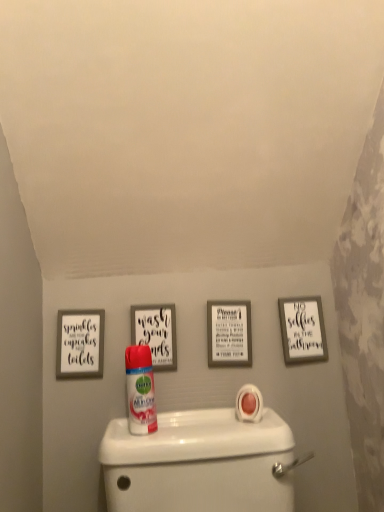
How much space does white matte picture frame at center, which is the third picture frame in left-to-right order, occupy vertically?

The height of white matte picture frame at center, which is the third picture frame in left-to-right order, is 7.19 inches.

What do you see at coordinates (140, 390) in the screenshot?
I see `white plastic can at center` at bounding box center [140, 390].

Locate an element on the screen. The width and height of the screenshot is (384, 512). white plastic can at center is located at coordinates (140, 390).

This screenshot has height=512, width=384. What do you see at coordinates (302, 330) in the screenshot?
I see `white matte picture frame at upper right, acting as the fourth picture frame starting from the left` at bounding box center [302, 330].

Identify the location of white glossy toilet at lower center. This screenshot has height=512, width=384. (200, 463).

Is white glossy toilet at lower center at the left side of white plastic can at center?

Incorrect, white glossy toilet at lower center is not on the left side of white plastic can at center.

Is white glossy toilet at lower center positioned in front of white plastic can at center?

Yes, white glossy toilet at lower center is in front of white plastic can at center.

From a real-world perspective, is white glossy toilet at lower center on top of white plastic can at center?

Actually, white glossy toilet at lower center is physically below white plastic can at center in the real world.

Where is `cleaning product that appears on the left of white glossy toilet at lower center`? cleaning product that appears on the left of white glossy toilet at lower center is located at coordinates (140, 390).

Which is correct: white glossy toilet at lower center is inside white matte picture frame at center, which is the second picture frame from right to left, or outside of it?

white glossy toilet at lower center exists outside the volume of white matte picture frame at center, which is the second picture frame from right to left.

Considering their positions, is white glossy toilet at lower center located in front of or behind white matte picture frame at center, which is the third picture frame in left-to-right order?

white glossy toilet at lower center is positioned closer to the viewer than white matte picture frame at center, which is the third picture frame in left-to-right order.

Does white glossy toilet at lower center have a larger size compared to white matte picture frame at center, which is the third picture frame in left-to-right order?

Correct, white glossy toilet at lower center is larger in size than white matte picture frame at center, which is the third picture frame in left-to-right order.

How distant is white glossy toilet at lower center from white matte picture frame at center, which is the second picture frame from right to left?

white glossy toilet at lower center and white matte picture frame at center, which is the second picture frame from right to left, are 10.29 inches apart from each other.

Is white matte picture frame at center, which is the third picture frame in left-to-right order, not within matte black picture frame at center, arranged as the 3th picture frame when viewed from the right?

Yes, white matte picture frame at center, which is the third picture frame in left-to-right order, is located beyond the bounds of matte black picture frame at center, arranged as the 3th picture frame when viewed from the right.

From a real-world perspective, is white matte picture frame at center, which is the third picture frame in left-to-right order, on matte black picture frame at center, arranged as the 3th picture frame when viewed from the right?

Actually, white matte picture frame at center, which is the third picture frame in left-to-right order, is physically below matte black picture frame at center, arranged as the 3th picture frame when viewed from the right, in the real world.

Considering the relative positions of white matte picture frame at center, which is the second picture frame from right to left, and matte black picture frame at center, which ranks as the second picture frame in left-to-right order, in the image provided, is white matte picture frame at center, which is the second picture frame from right to left, in front of matte black picture frame at center, which ranks as the second picture frame in left-to-right order,?

No, white matte picture frame at center, which is the second picture frame from right to left, is further to the viewer.

Does white matte picture frame at center, which is the second picture frame from right to left, have a lesser height compared to matte black picture frame at center, which ranks as the second picture frame in left-to-right order?

No, white matte picture frame at center, which is the second picture frame from right to left, is not shorter than matte black picture frame at center, which ranks as the second picture frame in left-to-right order.

In the scene shown: Does white plastic can at center have a smaller size compared to white glossy toilet at lower center?

Correct, white plastic can at center occupies less space than white glossy toilet at lower center.

Considering the sizes of objects white plastic can at center and white glossy toilet at lower center in the image provided, who is taller, white plastic can at center or white glossy toilet at lower center?

white glossy toilet at lower center is taller.

Measure the distance from white plastic can at center to white glossy toilet at lower center.

white plastic can at center and white glossy toilet at lower center are 14.37 centimeters apart from each other.

Is white plastic can at center spatially inside white glossy toilet at lower center, or outside of it?

white plastic can at center is not inside white glossy toilet at lower center, it's outside.

Consider the image. Is matte black picture frame at center, which ranks as the second picture frame in left-to-right order, inside or outside of white matte picture frame at upper right, acting as the fourth picture frame starting from the left?

matte black picture frame at center, which ranks as the second picture frame in left-to-right order, is not inside white matte picture frame at upper right, acting as the fourth picture frame starting from the left, it's outside.

Can you confirm if matte black picture frame at center, which ranks as the second picture frame in left-to-right order, is taller than white matte picture frame at upper right, acting as the fourth picture frame starting from the left?

No.

Considering the points (170, 311) and (312, 351), which point is in front, point (170, 311) or point (312, 351)?

The point (170, 311) is closer to the camera.

Is matte black picture frame at center, which ranks as the second picture frame in left-to-right order, with white matte picture frame at upper left, arranged as the 4th picture frame when viewed from the right?

matte black picture frame at center, which ranks as the second picture frame in left-to-right order, and white matte picture frame at upper left, arranged as the 4th picture frame when viewed from the right, are not in contact.

From a real-world perspective, is matte black picture frame at center, which ranks as the second picture frame in left-to-right order, above or below white matte picture frame at upper left, arranged as the first picture frame when viewed from the left?

matte black picture frame at center, which ranks as the second picture frame in left-to-right order, is situated higher than white matte picture frame at upper left, arranged as the first picture frame when viewed from the left, in the real world.

Looking at their sizes, would you say matte black picture frame at center, which ranks as the second picture frame in left-to-right order, is wider or thinner than white matte picture frame at upper left, arranged as the first picture frame when viewed from the left?

Clearly, matte black picture frame at center, which ranks as the second picture frame in left-to-right order, has less width compared to white matte picture frame at upper left, arranged as the first picture frame when viewed from the left.

Where is `the 2nd picture frame below the white matte picture frame at upper left, arranged as the first picture frame when viewed from the left (from a real-world perspective)`? the 2nd picture frame below the white matte picture frame at upper left, arranged as the first picture frame when viewed from the left (from a real-world perspective) is located at coordinates (302, 330).

Is white matte picture frame at upper right, placed as the 1th picture frame when sorted from right to left, oriented away from white matte picture frame at upper left, arranged as the first picture frame when viewed from the left?

No, white matte picture frame at upper right, placed as the 1th picture frame when sorted from right to left, is not facing the opposite direction of white matte picture frame at upper left, arranged as the first picture frame when viewed from the left.

Is white matte picture frame at upper right, acting as the fourth picture frame starting from the left, not inside white matte picture frame at upper left, arranged as the 4th picture frame when viewed from the right?

Absolutely, white matte picture frame at upper right, acting as the fourth picture frame starting from the left, is external to white matte picture frame at upper left, arranged as the 4th picture frame when viewed from the right.

Does white matte picture frame at upper right, placed as the 1th picture frame when sorted from right to left, appear on the left side of white matte picture frame at upper left, arranged as the first picture frame when viewed from the left?

No.

This screenshot has height=512, width=384. Find the location of `cleaning product that is above the white glossy toilet at lower center (from a real-world perspective)`. cleaning product that is above the white glossy toilet at lower center (from a real-world perspective) is located at coordinates (140, 390).

You are a GUI agent. You are given a task and a screenshot of the screen. Output one action in this format:
    pyautogui.click(x=<x>, y=<y>)
    Task: Click on the toilet that appears below the white matte picture frame at center, which is the second picture frame from right to left (from the image's perspective)
    The width and height of the screenshot is (384, 512).
    Given the screenshot: What is the action you would take?
    [x=200, y=463]

Estimate the real-world distances between objects in this image. Which object is closer to white glossy toilet at lower center, white plastic can at center or white matte picture frame at upper left, arranged as the first picture frame when viewed from the left?

white plastic can at center.

When comparing their distances from white matte picture frame at center, which is the third picture frame in left-to-right order, does matte black picture frame at center, arranged as the 3th picture frame when viewed from the right, or white matte picture frame at upper left, arranged as the 4th picture frame when viewed from the right, seem further?

The object further to white matte picture frame at center, which is the third picture frame in left-to-right order, is white matte picture frame at upper left, arranged as the 4th picture frame when viewed from the right.

Based on their spatial positions, is white matte picture frame at center, which is the second picture frame from right to left, or white matte picture frame at upper left, arranged as the 4th picture frame when viewed from the right, closer to white matte picture frame at upper right, acting as the fourth picture frame starting from the left?

white matte picture frame at center, which is the second picture frame from right to left, is positioned closer to the anchor white matte picture frame at upper right, acting as the fourth picture frame starting from the left.

Considering their positions, is white matte picture frame at upper left, arranged as the 4th picture frame when viewed from the right, positioned further to white plastic can at center than matte black picture frame at center, which ranks as the second picture frame in left-to-right order?

white matte picture frame at upper left, arranged as the 4th picture frame when viewed from the right, is further to white plastic can at center.

Looking at the image, which one is located closer to white glossy toilet at lower center, white matte picture frame at upper left, arranged as the 4th picture frame when viewed from the right, or matte black picture frame at center, arranged as the 3th picture frame when viewed from the right?

matte black picture frame at center, arranged as the 3th picture frame when viewed from the right.

In the scene shown: Estimate the real-world distances between objects in this image. Which object is closer to white matte picture frame at upper right, acting as the fourth picture frame starting from the left, white glossy toilet at lower center or white matte picture frame at center, which is the second picture frame from right to left?

white matte picture frame at center, which is the second picture frame from right to left, is closer to white matte picture frame at upper right, acting as the fourth picture frame starting from the left.

Considering their positions, is white plastic can at center positioned further to matte black picture frame at center, arranged as the 3th picture frame when viewed from the right, than white matte picture frame at upper left, arranged as the first picture frame when viewed from the left?

white matte picture frame at upper left, arranged as the first picture frame when viewed from the left.

Estimate the real-world distances between objects in this image. Which object is further from white plastic can at center, white glossy toilet at lower center or white matte picture frame at center, which is the third picture frame in left-to-right order?

The object further to white plastic can at center is white matte picture frame at center, which is the third picture frame in left-to-right order.

At what (x,y) coordinates should I click in order to perform the action: click on cleaning product positioned between white glossy toilet at lower center and matte black picture frame at center, which ranks as the second picture frame in left-to-right order, from near to far. Please return your answer as a coordinate pair (x, y). Looking at the image, I should click on (140, 390).

Locate an element on the screen. picture frame between matte black picture frame at center, which ranks as the second picture frame in left-to-right order, and white matte picture frame at upper right, placed as the 1th picture frame when sorted from right to left is located at coordinates (229, 333).

At what (x,y) coordinates should I click in order to perform the action: click on cleaning product between white glossy toilet at lower center and white matte picture frame at upper left, arranged as the 4th picture frame when viewed from the right, from front to back. Please return your answer as a coordinate pair (x, y). This screenshot has height=512, width=384. Looking at the image, I should click on (140, 390).

Where is `cleaning product located between white matte picture frame at upper left, arranged as the 4th picture frame when viewed from the right, and white matte picture frame at center, which is the third picture frame in left-to-right order, in the left-right direction`? Image resolution: width=384 pixels, height=512 pixels. cleaning product located between white matte picture frame at upper left, arranged as the 4th picture frame when viewed from the right, and white matte picture frame at center, which is the third picture frame in left-to-right order, in the left-right direction is located at coordinates (140, 390).